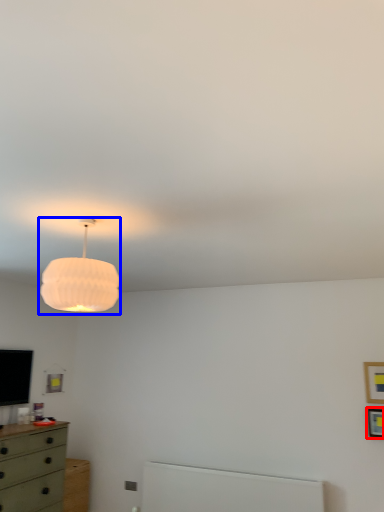
Question: Which of the following is the closest to the observer, picture frame (highlighted by a red box) or lamp (highlighted by a blue box)?

Choices:
 (A) picture frame
 (B) lamp

Answer: (B)